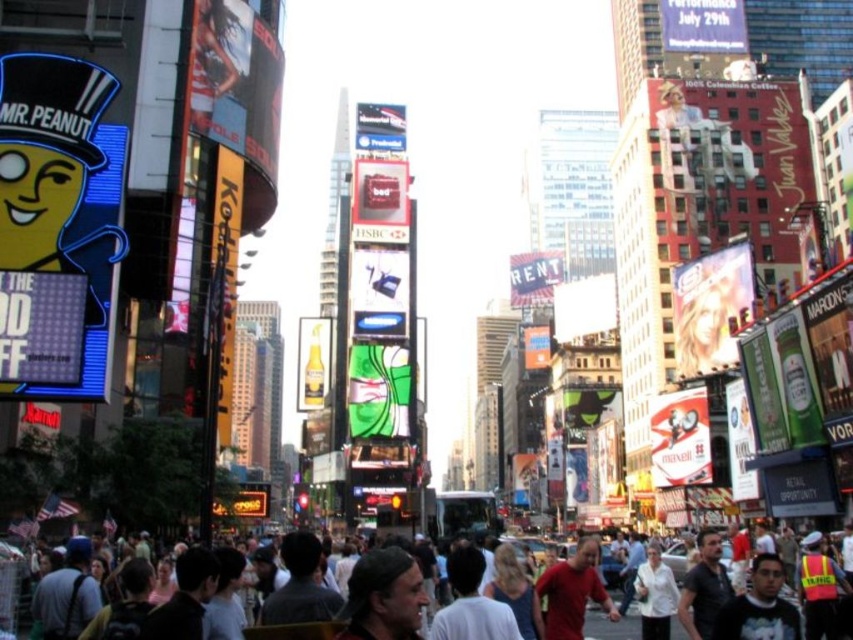
Who is taller, dark gray shirt at center or blonde hair at center?

dark gray shirt at center is taller.

This screenshot has width=853, height=640. What are the coordinates of `dark gray shirt at center` in the screenshot? It's located at (300, 586).

Can you confirm if light brown hair at center is bigger than blonde hair at center?

Yes.

Which is more to the left, light brown hair at center or blonde hair at center?

light brown hair at center is more to the left.

Is point (480, 612) farther from camera compared to point (527, 637)?

No, it is not.

You are a GUI agent. You are given a task and a screenshot of the screen. Output one action in this format:
    pyautogui.click(x=<x>, y=<y>)
    Task: Click on the light brown hair at center
    This screenshot has height=640, width=853.
    Given the screenshot: What is the action you would take?
    pyautogui.click(x=471, y=604)

Is the position of dark brown hair at center less distant than that of dark brown leather jacket at center?

Yes, dark brown hair at center is in front of dark brown leather jacket at center.

The width and height of the screenshot is (853, 640). Describe the element at coordinates (383, 596) in the screenshot. I see `dark brown hair at center` at that location.

At what (x,y) coordinates should I click in order to perform the action: click on dark brown hair at center. Please return your answer as a coordinate pair (x, y). Looking at the image, I should click on (383, 596).